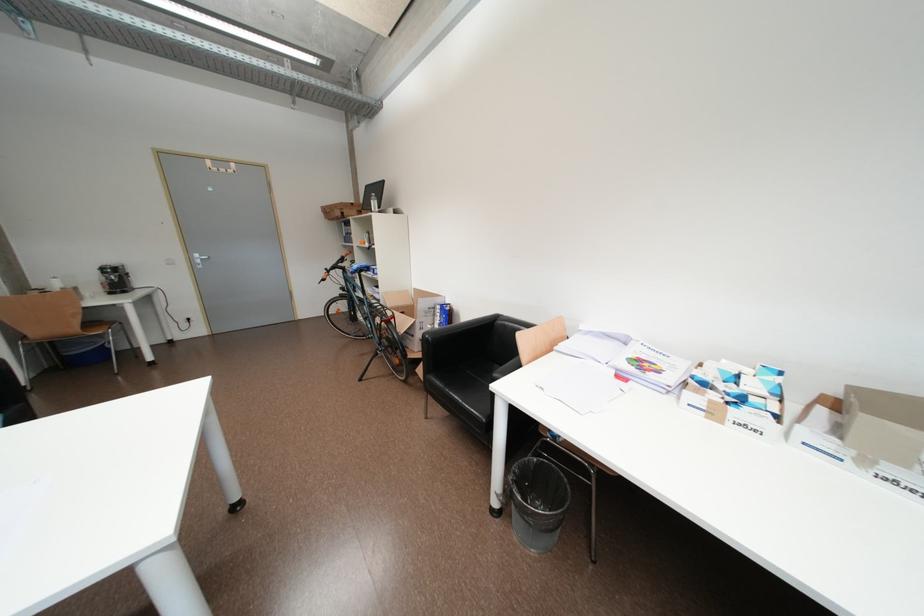
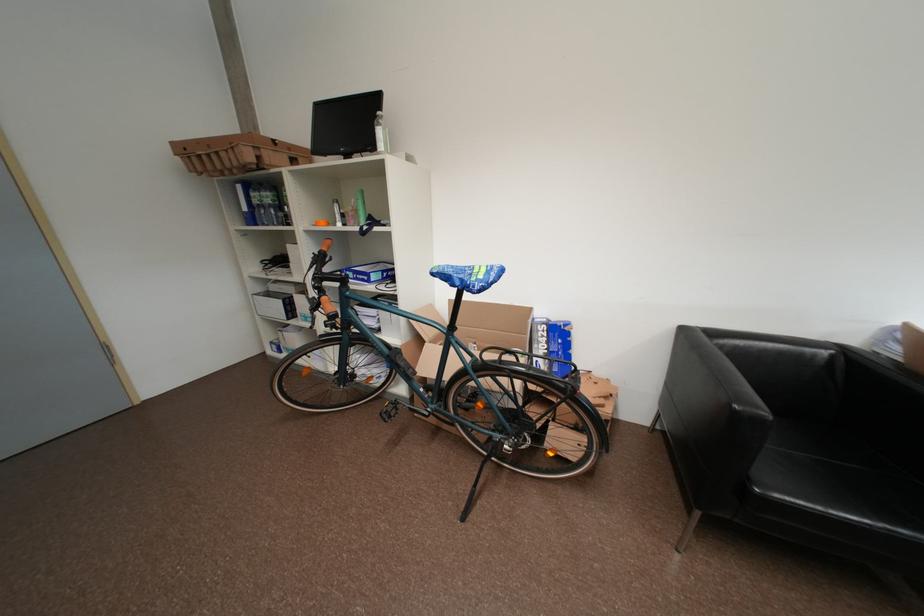
The point at (446, 309) is marked in the first image. Where is the corresponding point in the second image?

(553, 329)